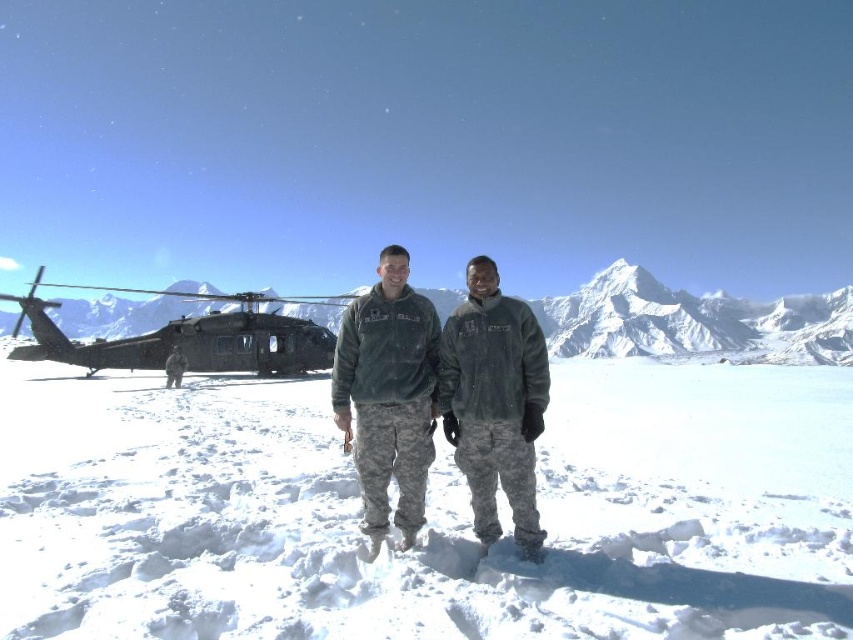
Question: Considering the real-world distances, which object is farthest from the dark gray matte helicopter at center-left?

Choices:
 (A) green fleece jacket at center
 (B) camouflage uniform at center
 (C) dark green fleece jacket at center

Answer: (C)

Question: Which point appears farthest from the camera in this image?

Choices:
 (A) (178, 380)
 (B) (693, 502)
 (C) (39, 330)

Answer: (A)

Question: Is green matte jacket at center thinner than snowy white mountain at center?

Choices:
 (A) yes
 (B) no

Answer: (A)

Question: Does white powdery snow at center come in front of green fleece jacket at center?

Choices:
 (A) no
 (B) yes

Answer: (B)

Question: Can you confirm if white powdery snow at center is positioned below snowy white mountain at center?

Choices:
 (A) no
 (B) yes

Answer: (B)

Question: Which of the following is the farthest from the observer?

Choices:
 (A) camouflage uniform at center
 (B) dark green fleece jacket at center

Answer: (A)